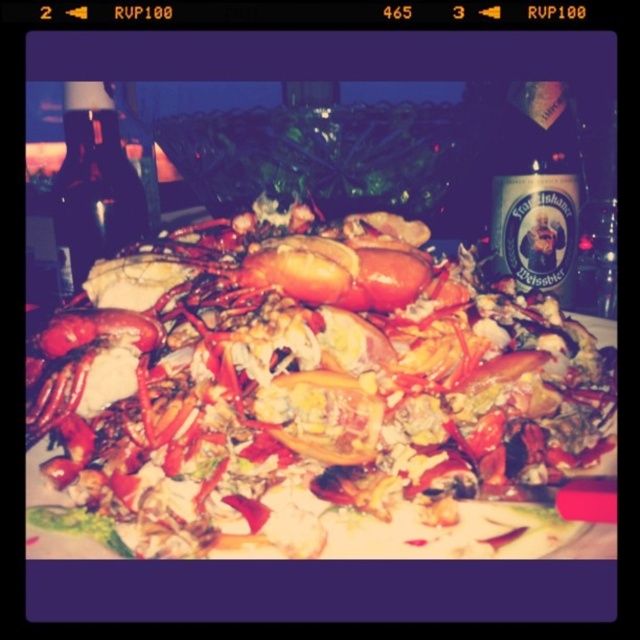
You are a food critic holding a camera 10 inches away from the shiny red lobster at center. Can you capture the entire lobster in your shot without moving the camera?

The shiny red lobster at center is 8.49 inches away from the viewer. Since your camera is 10 inches away, it is within range to capture the entire lobster without moving.

You are a food critic evaluating the presentation of this seafood platter. Based on the image, which object is bigger in size between the shiny red lobster at center and the translucent glass bottle at upper right?

The shiny red lobster at center is larger in size compared to the translucent glass bottle at upper right according to the description.